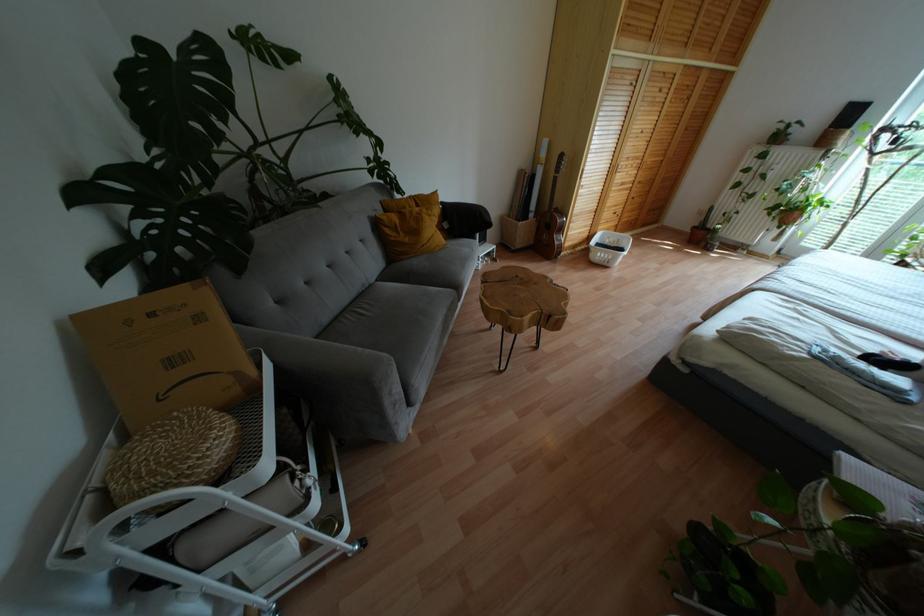
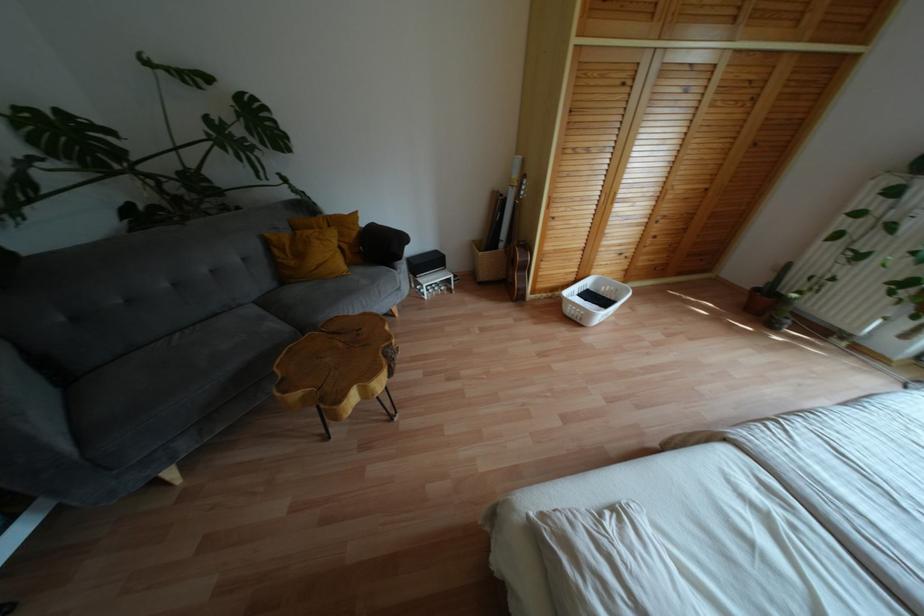
Locate, in the second image, the point that corresponds to point 463,220 in the first image.

(380, 246)